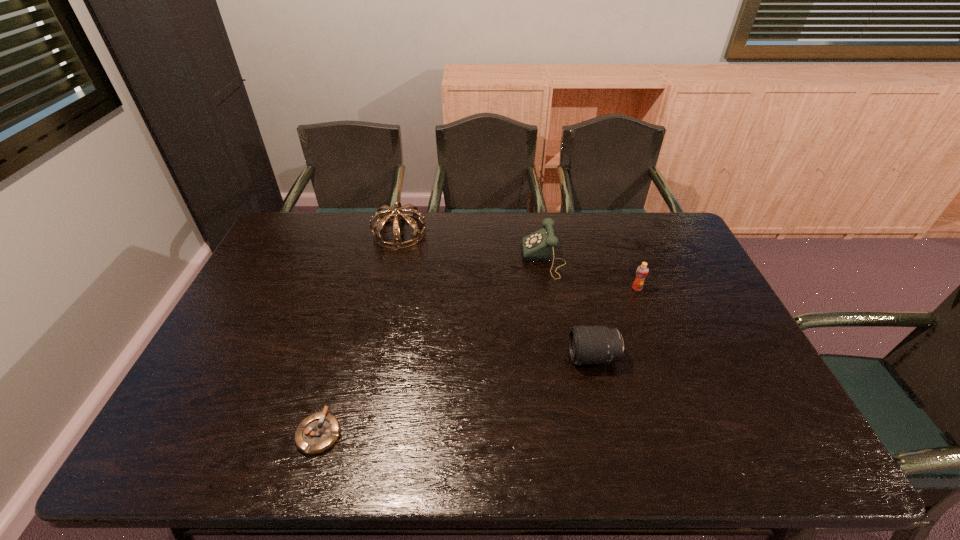
Where is `vacant area at the near edge`? The width and height of the screenshot is (960, 540). vacant area at the near edge is located at coordinates (516, 438).

Locate an element on the screen. free space at the left edge of the desktop is located at coordinates (232, 423).

The height and width of the screenshot is (540, 960). In the image, there is a desktop. In order to click on vacant area at the right edge in this screenshot , I will do `click(714, 319)`.

In order to click on vacant space at the far right corner of the desktop in this screenshot , I will do `click(660, 224)`.

This screenshot has width=960, height=540. I want to click on empty space that is in between the telephoto lens and the nearest object, so click(x=456, y=395).

Identify the location of free space between the shortest object and the telephoto lens. (456, 395).

This screenshot has height=540, width=960. In order to click on blank region between the nearest object and the tallest object in this screenshot , I will do `click(359, 333)`.

The width and height of the screenshot is (960, 540). In order to click on free area in between the tiara and the second nearest object in this screenshot , I will do `click(496, 295)`.

You are a GUI agent. You are given a task and a screenshot of the screen. Output one action in this format:
    pyautogui.click(x=<x>, y=<y>)
    Task: Click on the vacant area between the orange juice and the ashtray
    The height and width of the screenshot is (540, 960).
    Given the screenshot: What is the action you would take?
    pyautogui.click(x=478, y=361)

The width and height of the screenshot is (960, 540). Find the location of `free space between the fourth farthest object and the telephone`. free space between the fourth farthest object and the telephone is located at coordinates (568, 308).